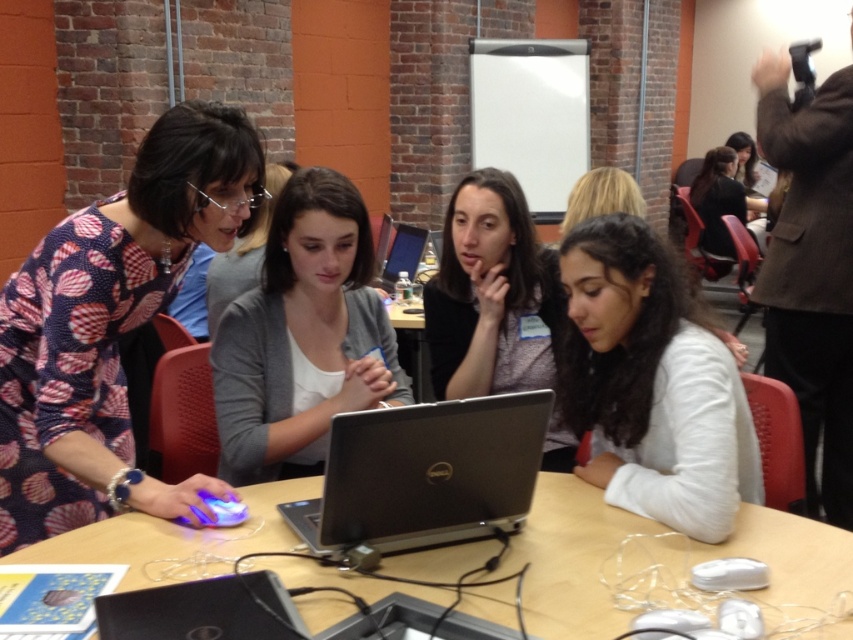
You are a delivery person who needs to place a 1.5 cm thick package on either the patterned fabric blouse at left or the wooden table at center. Which surface can accommodate the package without bending?

The wooden table at center is thicker than the patterned fabric blouse at left. Since the package is 1.5 cm thick, the wooden table at center can accommodate it without bending.

You are a person with a 12 inch wide notebook. You want to place it between the gray cardigan at center and the silver metallic laptop at center. Is there enough space?

The distance between the gray cardigan at center and the silver metallic laptop at center is 15.75 inches. Since your notebook is 12 inches wide, there is sufficient space to place it between them.

Looking at this image, you are a photographer trying to capture a closeup of the silver metallic laptop at center without including the gray cardigan at center in the frame. Based on their relative heights, is this possible?

The gray cardigan at center is taller than the silver metallic laptop at center, so it might block the view of the laptop. Therefore, capturing a closeup of the silver metallic laptop at center without including the gray cardigan at center might not be possible due to the cardigan being taller and potentially obscuring the laptop.